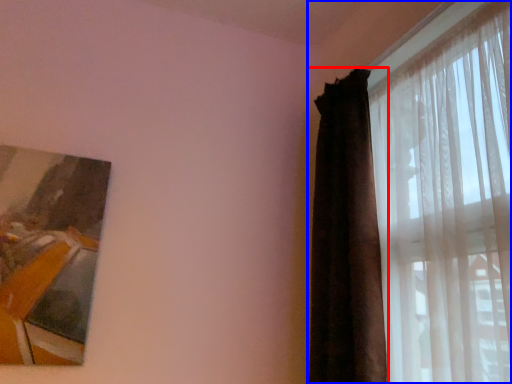
Question: Which of the following is the closest to the observer, curtain (highlighted by a red box) or curtain (highlighted by a blue box)?

Choices:
 (A) curtain
 (B) curtain

Answer: (B)